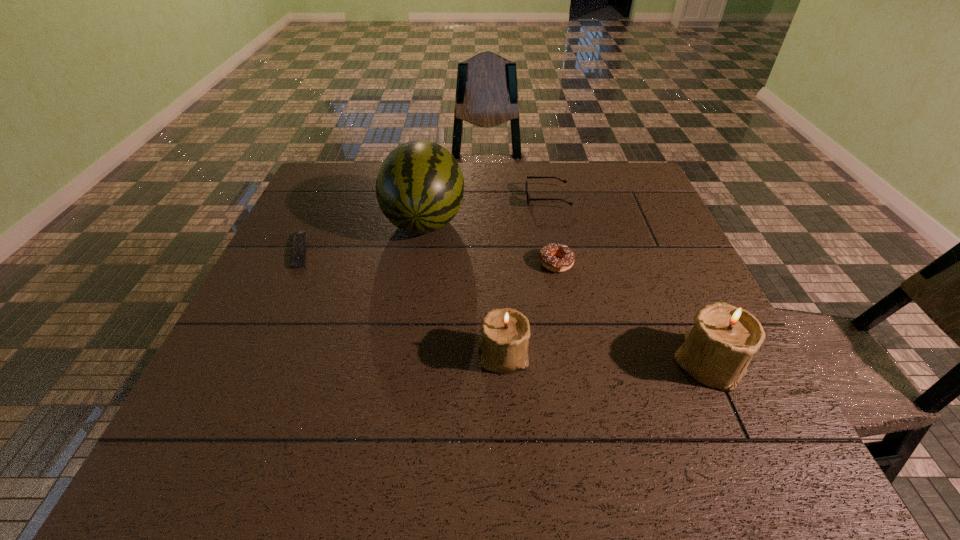
The width and height of the screenshot is (960, 540). I want to click on vacant area situated 0.070m on the front of the fourth object from right to left, so click(x=506, y=409).

At what (x,y) coordinates should I click in order to perform the action: click on vacant area situated 0.320m on the back of the right candle_holder. Please return your answer as a coordinate pair (x, y). Image resolution: width=960 pixels, height=540 pixels. Looking at the image, I should click on (652, 241).

What are the coordinates of `vacant region located on the front lenses of the sunglasses` in the screenshot? It's located at (416, 199).

The width and height of the screenshot is (960, 540). Identify the location of vacant space located 0.080m on the front lenses of the sunglasses. (499, 199).

The width and height of the screenshot is (960, 540). In order to click on blank space located 0.120m on the front lenses of the sunglasses in this screenshot , I will do `click(486, 199)`.

Identify the location of vacant region located 0.050m at the stem end of the watermelon. The height and width of the screenshot is (540, 960). (418, 265).

I want to click on vacant space located 0.080m on the back of the remote control, so click(x=318, y=216).

The width and height of the screenshot is (960, 540). In order to click on vacant area situated on the left of the doughnut in this screenshot , I will do `click(421, 263)`.

Where is `sunglasses present at the far edge`? Image resolution: width=960 pixels, height=540 pixels. sunglasses present at the far edge is located at coordinates (529, 199).

I want to click on watermelon that is at the far edge, so click(419, 188).